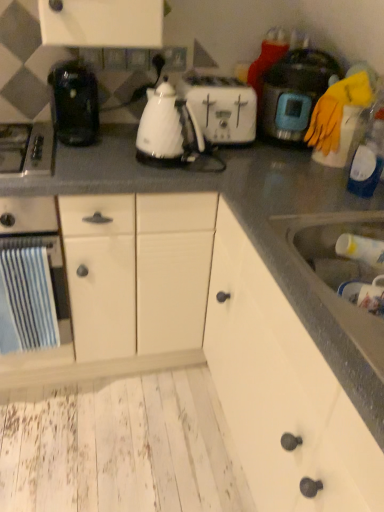
Locate an element on the screen. Image resolution: width=384 pixels, height=512 pixels. free space in front of white plastic toaster at center is located at coordinates (235, 156).